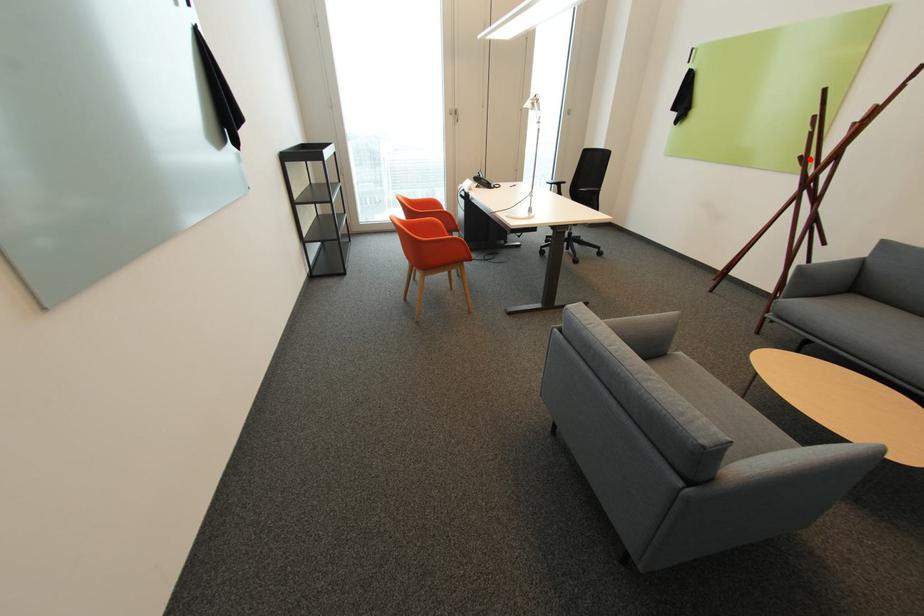
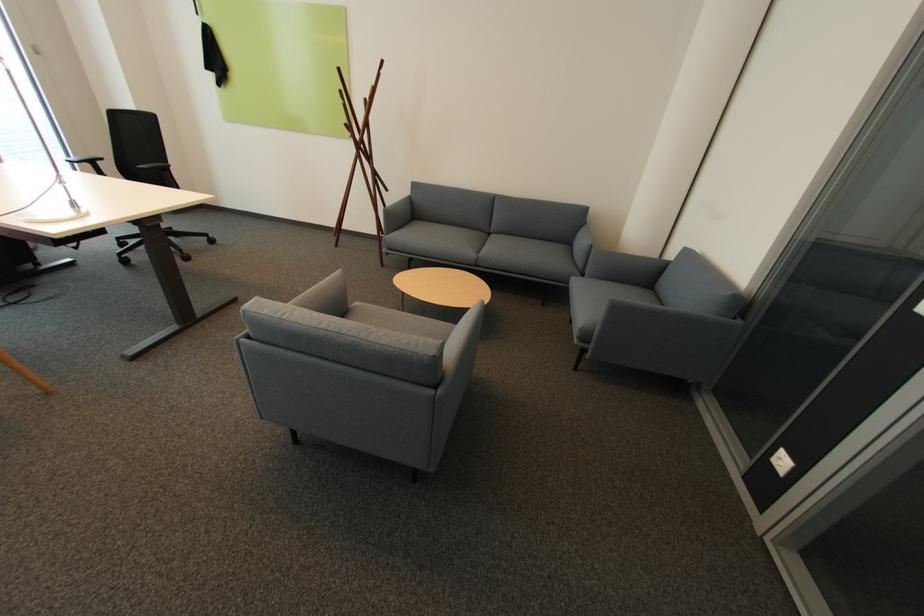
Question: I am providing you with two images of the same scene from different viewpoints. A red point is marked on the first image. Is the red point's position out of view in image 2?

Choices:
 (A) Yes
 (B) No

Answer: (B)